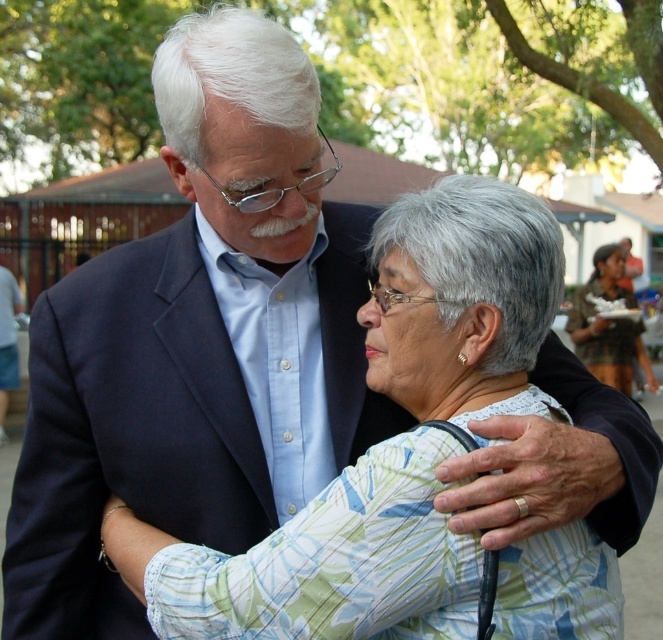
Which is behind, point (577, 346) or point (1, 342)?

The point (1, 342) is more distant.

Does camouflage fabric shirt at right appear under matte blue suit at center?

Correct, camouflage fabric shirt at right is located below matte blue suit at center.

Is point (599, 340) positioned in front of point (11, 340)?

Yes, it is.

Locate an element on the screen. This screenshot has width=663, height=640. camouflage fabric shirt at right is located at coordinates (609, 324).